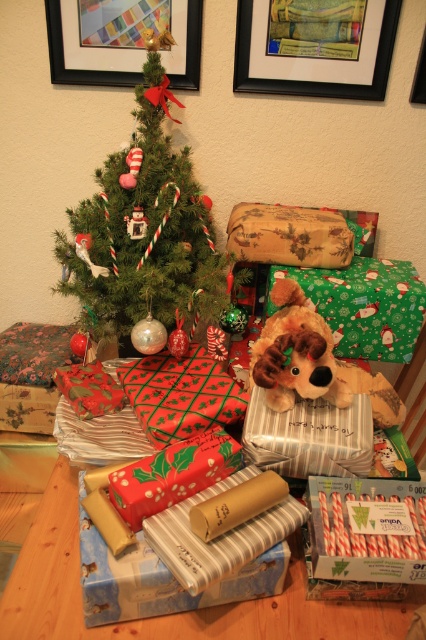
Between holly-patterned paper at center and black plastic picture frame at upper right, which one is positioned higher?

Positioned higher is black plastic picture frame at upper right.

Is holly-patterned paper at center to the left of black plastic picture frame at upper right from the viewer's perspective?

Correct, you'll find holly-patterned paper at center to the left of black plastic picture frame at upper right.

Describe the element at coordinates (172, 474) in the screenshot. I see `holly-patterned paper at center` at that location.

Where is `holly-patterned paper at center`? The height and width of the screenshot is (640, 426). holly-patterned paper at center is located at coordinates (172, 474).

Is brushed metal picture frame at upper center below red striped candy canes at center?

No.

What do you see at coordinates (123, 40) in the screenshot? I see `brushed metal picture frame at upper center` at bounding box center [123, 40].

What do you see at coordinates (123, 40) in the screenshot?
I see `brushed metal picture frame at upper center` at bounding box center [123, 40].

Image resolution: width=426 pixels, height=640 pixels. In order to click on brushed metal picture frame at upper center in this screenshot , I will do `click(123, 40)`.

Is point (221, 401) farther from viewer compared to point (414, 84)?

No, (221, 401) is closer to viewer.

Which is behind, point (146, 400) or point (417, 65)?

The point (417, 65) is more distant.

What are the coordinates of `shiny red wrapping paper at center` in the screenshot? It's located at (181, 394).